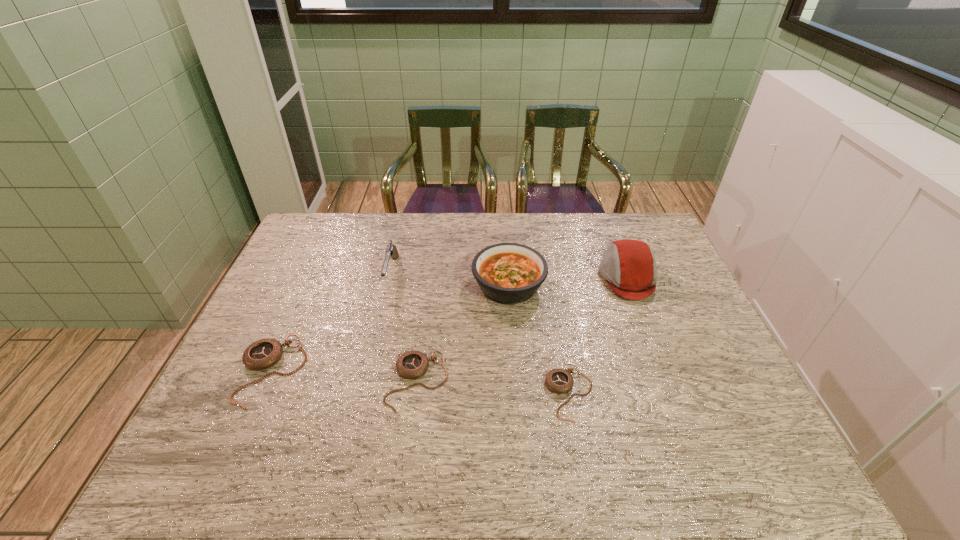
The image size is (960, 540). Find the location of `the leftmost object`. the leftmost object is located at coordinates (262, 354).

Identify the location of the fifth tallest object. (x=413, y=364).

I want to click on the fourth object from right to left, so click(413, 364).

Where is `the rightmost pocket watch`? the rightmost pocket watch is located at coordinates (559, 381).

You are a GUI agent. You are given a task and a screenshot of the screen. Output one action in this format:
    pyautogui.click(x=<x>, y=<y>)
    Task: Click on the shortest object
    The image size is (960, 540).
    Given the screenshot: What is the action you would take?
    pyautogui.click(x=559, y=381)

Locate an element on the screen. Image resolution: width=960 pixels, height=540 pixels. the second object from left to right is located at coordinates (391, 251).

This screenshot has height=540, width=960. What are the coordinates of `the tallest object` in the screenshot? It's located at (629, 267).

Where is `cap`? The height and width of the screenshot is (540, 960). cap is located at coordinates (629, 267).

The width and height of the screenshot is (960, 540). Find the location of `stew`. stew is located at coordinates (508, 273).

This screenshot has height=540, width=960. Find the location of `vacant space situated on the back of the leftmost pocket watch`. vacant space situated on the back of the leftmost pocket watch is located at coordinates click(x=312, y=278).